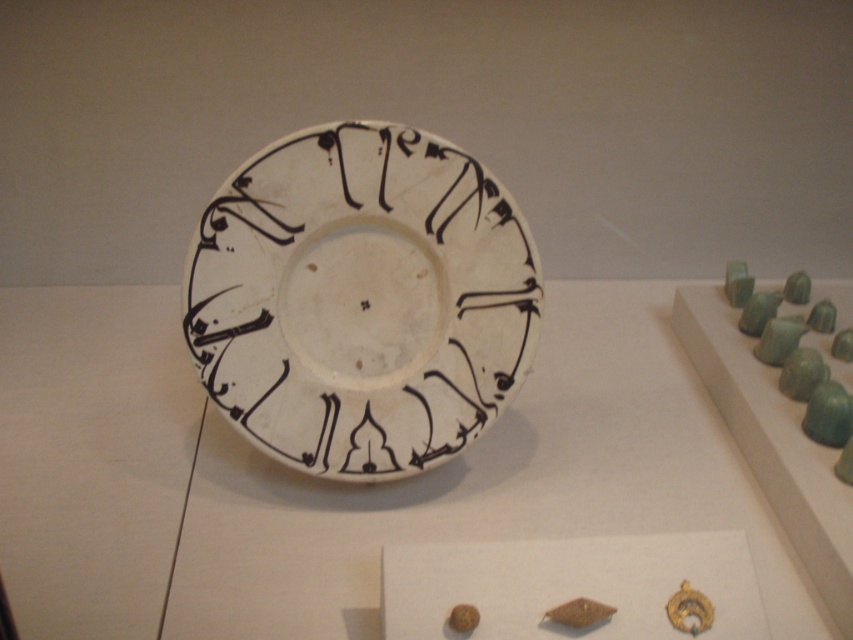
Question: Among these points, which one is farthest from the camera?

Choices:
 (A) (833, 424)
 (B) (498, 221)

Answer: (A)

Question: Does white glossy plate at center appear on the left side of green jade beads at right?

Choices:
 (A) yes
 (B) no

Answer: (A)

Question: Is white glossy plate at center further to the viewer compared to green jade beads at right?

Choices:
 (A) yes
 (B) no

Answer: (B)

Question: Considering the relative positions of white glossy plate at center and green jade beads at right in the image provided, where is white glossy plate at center located with respect to green jade beads at right?

Choices:
 (A) above
 (B) below

Answer: (A)

Question: Among these points, which one is nearest to the camera?

Choices:
 (A) (315, 381)
 (B) (810, 362)

Answer: (A)